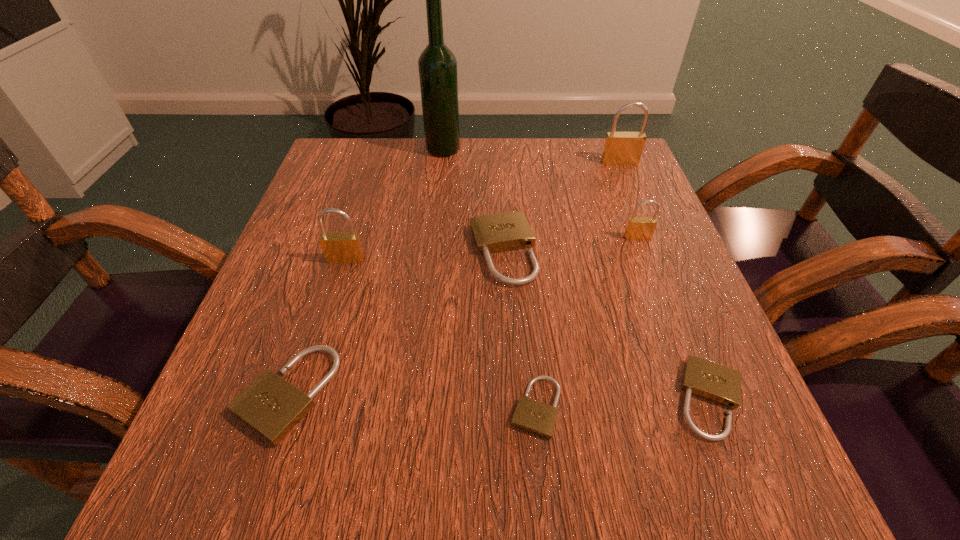
The image size is (960, 540). In order to click on free spot located on the back of the fourth shortest object in this screenshot , I will do `click(497, 154)`.

Identify the location of vacant space located on the right of the fifth tallest padlock. (488, 394).

The width and height of the screenshot is (960, 540). Find the location of `vacant space located 0.050m on the left of the sixth tallest padlock`. vacant space located 0.050m on the left of the sixth tallest padlock is located at coordinates (640, 399).

This screenshot has height=540, width=960. Find the location of `free space located on the left of the shortest object`. free space located on the left of the shortest object is located at coordinates (260, 407).

Identify the location of liquor located in the far edge section of the desktop. The width and height of the screenshot is (960, 540). (437, 65).

You are a GUI agent. You are given a task and a screenshot of the screen. Output one action in this format:
    pyautogui.click(x=<x>, y=<y>)
    Task: Click on the padlock located at the far edge
    This screenshot has height=540, width=960.
    Given the screenshot: What is the action you would take?
    pyautogui.click(x=621, y=148)

You are a GUI agent. You are given a task and a screenshot of the screen. Output one action in this format:
    pyautogui.click(x=<x>, y=<y>)
    Task: Click on the object located in the near left corner section of the desktop
    The width and height of the screenshot is (960, 540).
    Given the screenshot: What is the action you would take?
    pyautogui.click(x=272, y=407)

This screenshot has width=960, height=540. Find the location of `object that is at the far right corner`. object that is at the far right corner is located at coordinates (621, 148).

The height and width of the screenshot is (540, 960). What are the coordinates of `object located at the near right corner` in the screenshot? It's located at (720, 384).

Where is `free spot at the far edge of the desktop`? free spot at the far edge of the desktop is located at coordinates (394, 185).